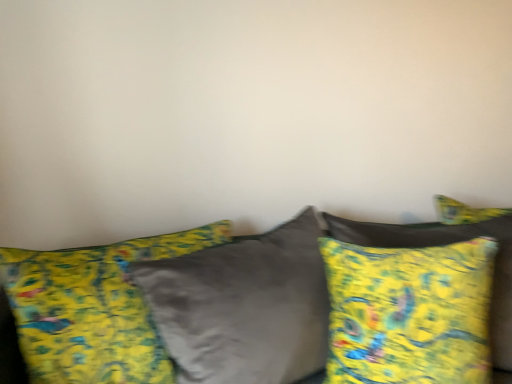
Question: Is yellow fabric pillow at center, the 1th pillow in the left-to-right sequence, taller or shorter than velvet yellow pillows at center?

Choices:
 (A) tall
 (B) short

Answer: (A)

Question: In the image, is yellow fabric pillow at center, the 1th pillow in the left-to-right sequence, positioned in front of or behind velvet yellow pillows at center?

Choices:
 (A) front
 (B) behind

Answer: (B)

Question: Considering the real-world distances, which object is farthest from the yellow fabric pillow at center, acting as the second pillow starting from the right?

Choices:
 (A) velvet yellow pillows at center
 (B) yellow fabric pillow at right, the second pillow from the left

Answer: (B)

Question: Based on their relative distances, which object is nearer to the yellow fabric pillow at right, the second pillow from the left?

Choices:
 (A) yellow fabric pillow at center, the 1th pillow in the left-to-right sequence
 (B) velvet yellow pillows at center

Answer: (B)